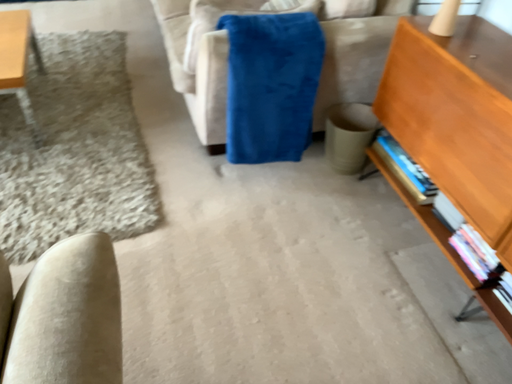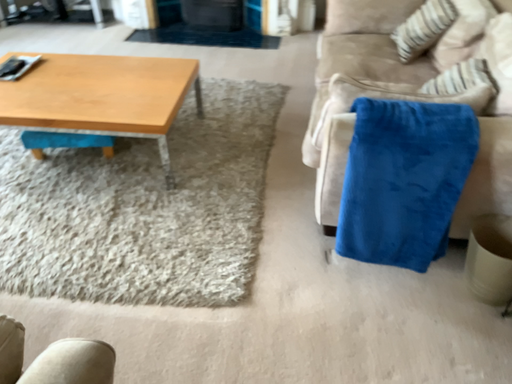
Question: How did the camera likely rotate when shooting the video?

Choices:
 (A) rotated left
 (B) rotated right

Answer: (A)